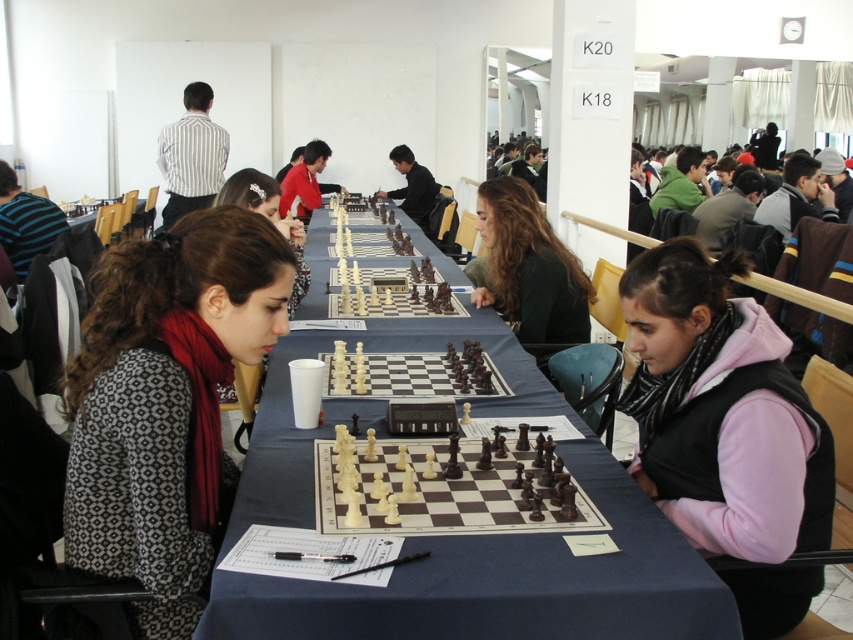
You are a photographer trying to capture a closeup of the chess pieces while avoiding blocking the players. Since both the matte black hair at center and the matte black chess set at center are in the center, which one should you move slightly to the side to get a clear shot of the chess set?

The matte black hair at center is bigger than the matte black chess set at center, so moving the matte black hair at center slightly to the side would allow you to get a clear shot of the matte black chess set at center without blocking the players.

In the scene shown: You are a photographer standing at the entrance of the hall. You want to take a photo of the matte black hair at center and the matte black chess set at center in the same frame. Given that your camera has a maximum focus range of 3 meters, will you be able to capture both objects clearly in one shot?

The matte black hair at center and the matte black chess set at center are 3.54 meters apart. Since the distance between them exceeds the camera maximum focus range of 3 meters, you won not be able to capture both objects clearly in one shot.

You are a photographer standing at the back of the hall. You want to take a photo of the green matte shirt at center and the matte black hair at center so that both are clearly visible in the frame. Given that your camera has a minimum focus distance of 36 inches, will you be able to capture both subjects without moving closer?

The green matte shirt at center is 35.81 inches from matte black hair at center. Since the distance between them is less than the camera minimum focus distance of 36 inches, you will not be able to capture both subjects clearly in the same frame without moving closer.